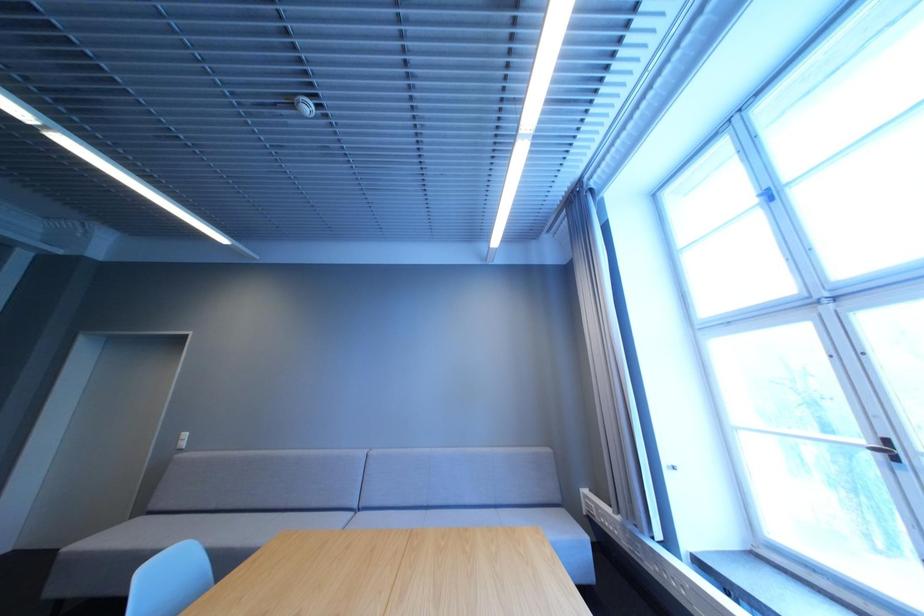
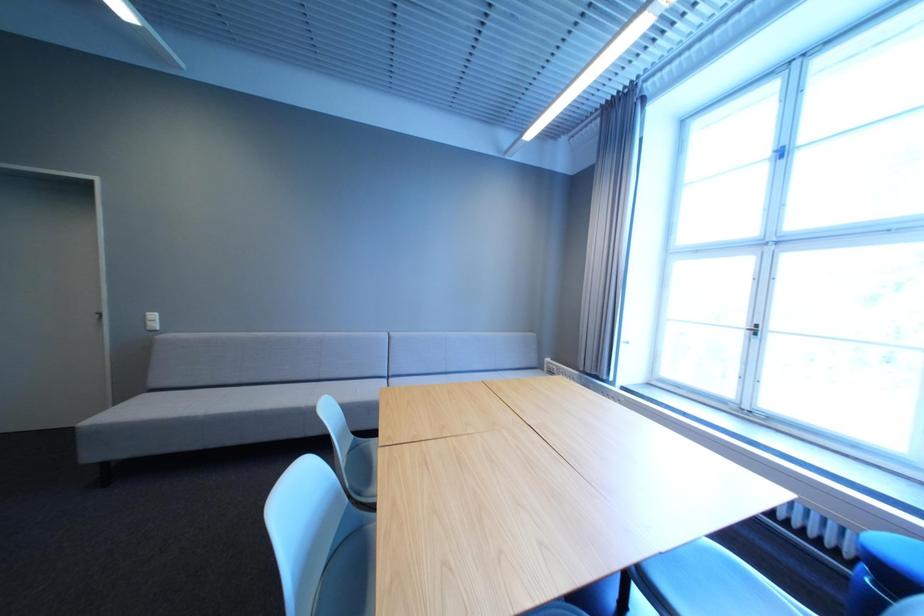
Based on the continuous images, in which direction is the camera rotating?

The camera's rotation is toward right-down.